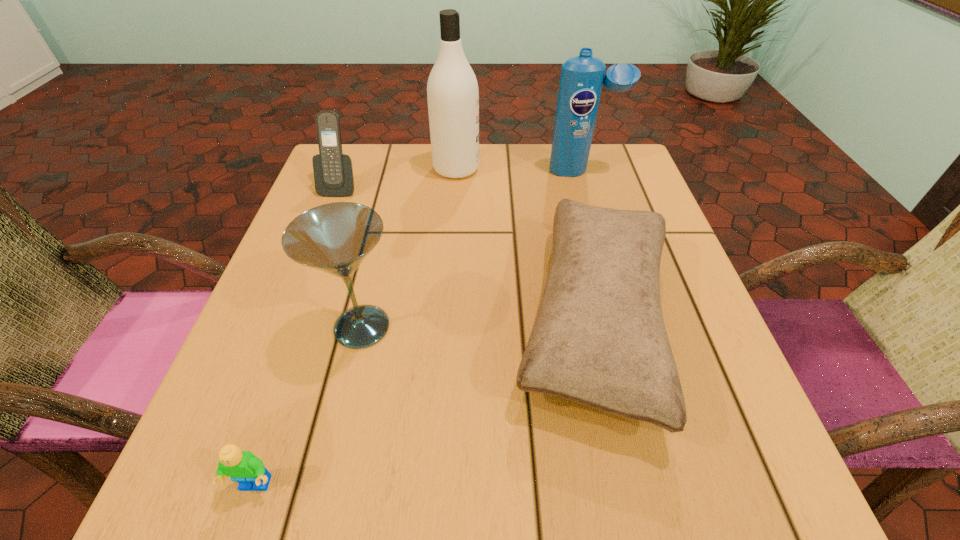
The height and width of the screenshot is (540, 960). I want to click on vacant space that satisfies the following two spatial constraints: 1. on the front-facing side of the cellular telephone; 2. on the left side of the second shortest object, so click(289, 320).

This screenshot has width=960, height=540. I want to click on vacant point that satisfies the following two spatial constraints: 1. on the front-facing side of the fourth tallest object; 2. on the right side of the cushion, so click(x=289, y=320).

Identify the location of free space that satisfies the following two spatial constraints: 1. on the front-facing side of the tallest object; 2. on the front-facing side of the cellular telephone. Image resolution: width=960 pixels, height=540 pixels. (455, 186).

Identify the location of vacant space that satisfies the following two spatial constraints: 1. on the front-facing side of the third shortest object; 2. on the right side of the cushion. This screenshot has height=540, width=960. coord(289,320).

At what (x,y) coordinates should I click in order to perform the action: click on vacant area in the image that satisfies the following two spatial constraints: 1. on the front-facing side of the third shortest object; 2. on the right side of the cushion. Please return your answer as a coordinate pair (x, y). The height and width of the screenshot is (540, 960). Looking at the image, I should click on (289, 320).